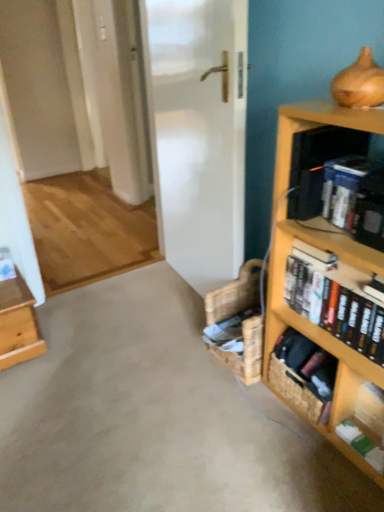
You are a GUI agent. You are given a task and a screenshot of the screen. Output one action in this format:
    pyautogui.click(x=<x>, y=<y>)
    Task: Click on the free space that is in between light brown wooden table at left and woven brown basket at lower right
    
    Given the screenshot: What is the action you would take?
    click(x=142, y=368)